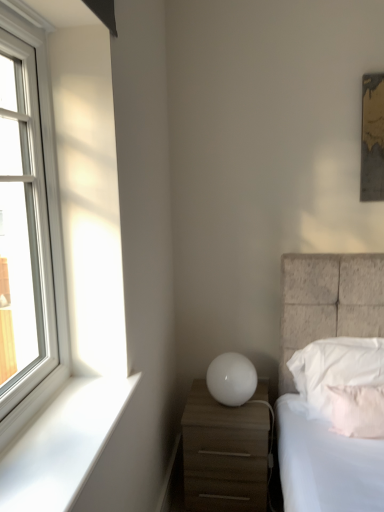
Question: Based on their positions, is white soft pillow at right, which is the 2th pillow in front-to-back order, located to the left or right of white matte nightstand at lower right?

Choices:
 (A) right
 (B) left

Answer: (A)

Question: Based on their sizes in the image, would you say white soft pillow at right, which is the 2th pillow in front-to-back order, is bigger or smaller than white matte nightstand at lower right?

Choices:
 (A) big
 (B) small

Answer: (B)

Question: Estimate the real-world distances between objects in this image. Which object is farther from the white glossy sphere at center?

Choices:
 (A) pink fabric pillow at lower right, the first pillow when ordered from front to back
 (B) white matte nightstand at lower right
 (C) white glass window at left
 (D) white smooth window sill at lower left
 (E) white soft pillow at right, which is the 2th pillow in front-to-back order

Answer: (C)

Question: Estimate the real-world distances between objects in this image. Which object is closer to the white soft pillow at right, the first pillow when ordered from back to front?

Choices:
 (A) white smooth window sill at lower left
 (B) pink fabric pillow at lower right, which appears as the 2th pillow when viewed from the back
 (C) white glossy sphere at center
 (D) white glass window at left
 (E) white matte nightstand at lower right

Answer: (B)